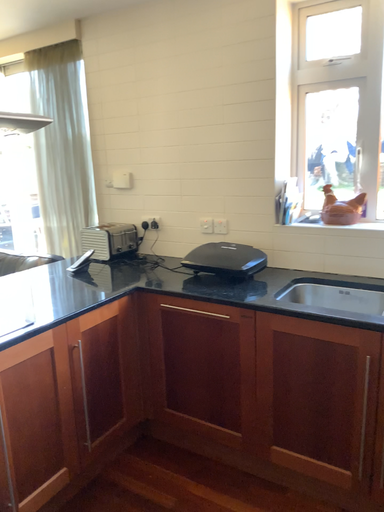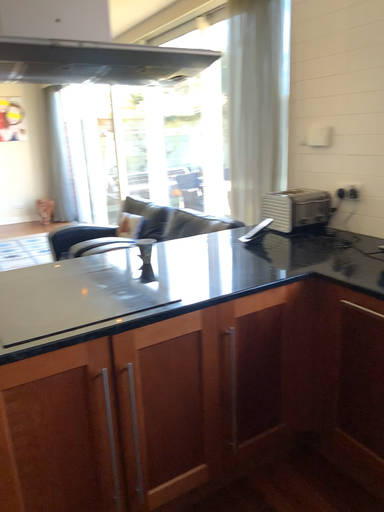
Question: How did the camera likely rotate when shooting the video?

Choices:
 (A) rotated left
 (B) rotated right

Answer: (A)